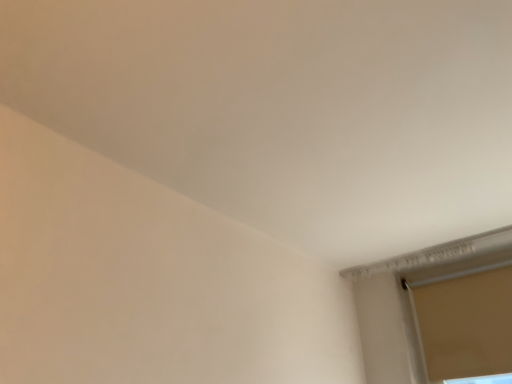
What is the approximate width of beige fabric screen door at lower right?

It is 2.05 inches.

Image resolution: width=512 pixels, height=384 pixels. Find the location of `beige fabric screen door at lower right`. beige fabric screen door at lower right is located at coordinates (465, 324).

Image resolution: width=512 pixels, height=384 pixels. Describe the element at coordinates (465, 324) in the screenshot. I see `beige fabric screen door at lower right` at that location.

Locate an element on the screen. beige fabric screen door at lower right is located at coordinates pyautogui.click(x=465, y=324).